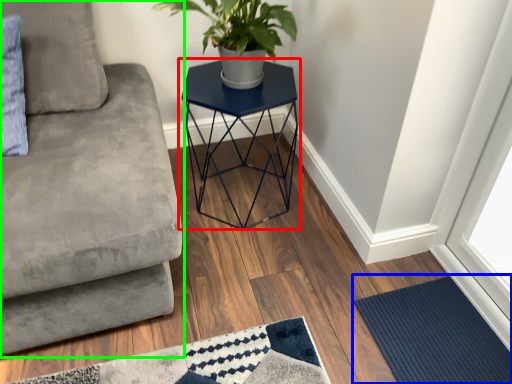
Question: Which is nearer to the table (highlighted by a red box)? doormat (highlighted by a blue box) or studio couch (highlighted by a green box).

Choices:
 (A) doormat
 (B) studio couch

Answer: (B)